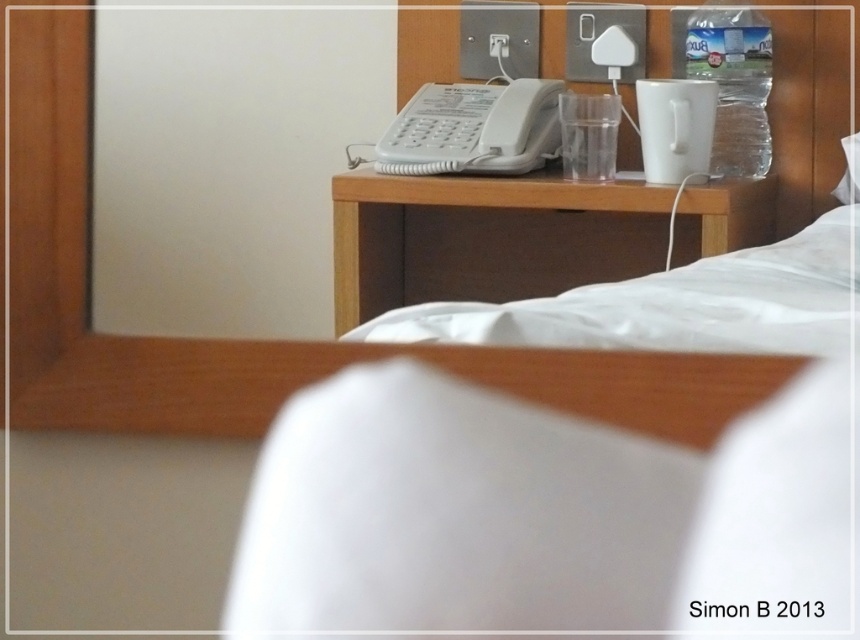
Question: Among these objects, which one is farthest from the camera?

Choices:
 (A) transparent plastic bottle at center
 (B) clear plastic bottle at upper right

Answer: (A)

Question: Does wooden headboard at upper center have a lesser width compared to clear plastic bottle at upper right?

Choices:
 (A) yes
 (B) no

Answer: (B)

Question: Does matte wooden mirror at upper center lie in front of transparent plastic bottle at center?

Choices:
 (A) yes
 (B) no

Answer: (A)

Question: Which object is the closest to the wooden headboard at upper center?

Choices:
 (A) transparent plastic bottle at center
 (B) clear plastic bottle at upper right

Answer: (A)

Question: Does wooden headboard at upper center have a lesser width compared to transparent plastic bottle at center?

Choices:
 (A) no
 (B) yes

Answer: (A)

Question: Which of the following is the farthest from the observer?

Choices:
 (A) (717, 20)
 (B) (627, 48)

Answer: (B)